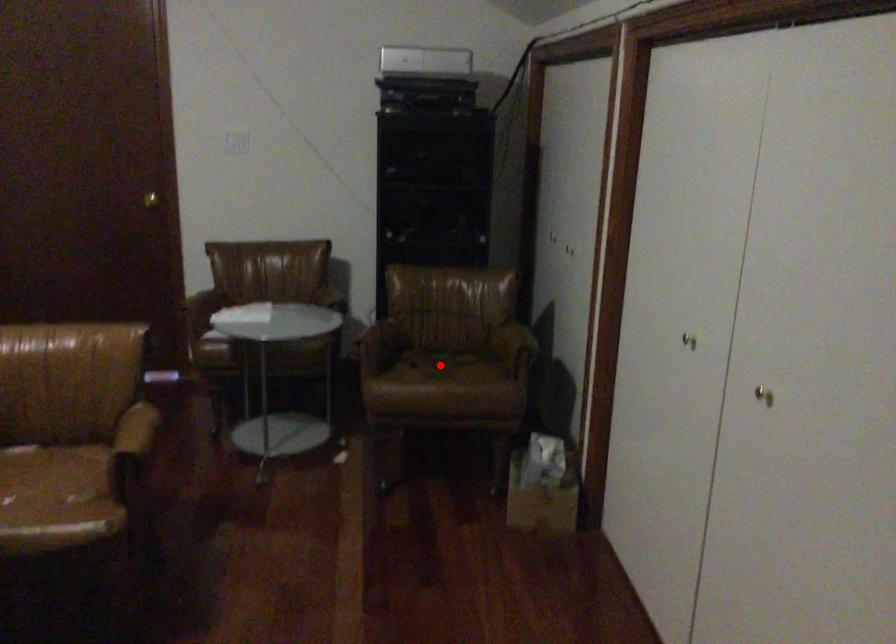
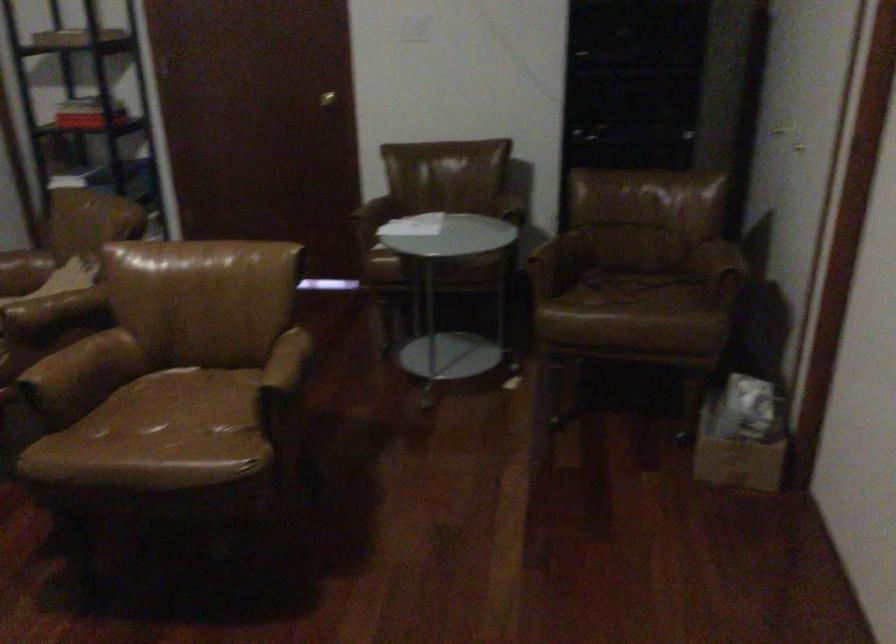
Locate, in the second image, the point that corresponds to the highlighted location in the first image.

(627, 288)